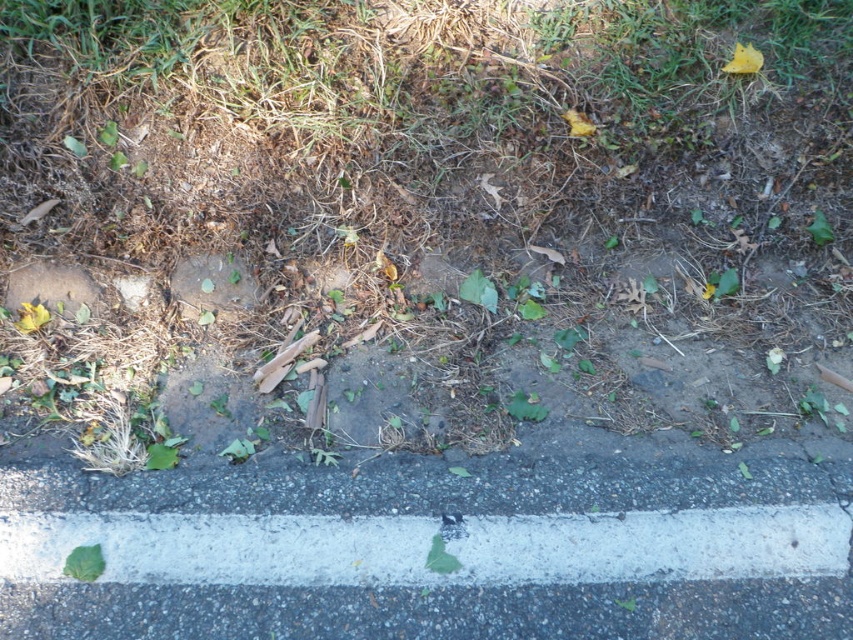
You are a gardener who needs to mow the lawn. You see the green leafy grass at center and the green leafy at lower left. Which area requires immediate attention because it is taller?

The green leafy grass at center requires immediate attention because it is much taller than the green leafy at lower left.

You are a gardener looking at the roadside area. You see two plants, the green leafy at lower left and the green leafy weed at lower center. Which one is shorter?

The green leafy at lower left is shorter compared to the green leafy weed at lower center.

In the scene shown: You are standing on the roadside and see the white painted curb at lower center and the green leafy at lower left. Which object is positioned closer to the left side of the image?

The green leafy at lower left is positioned closer to the left side of the image because it is to the left of the white painted curb at lower center.